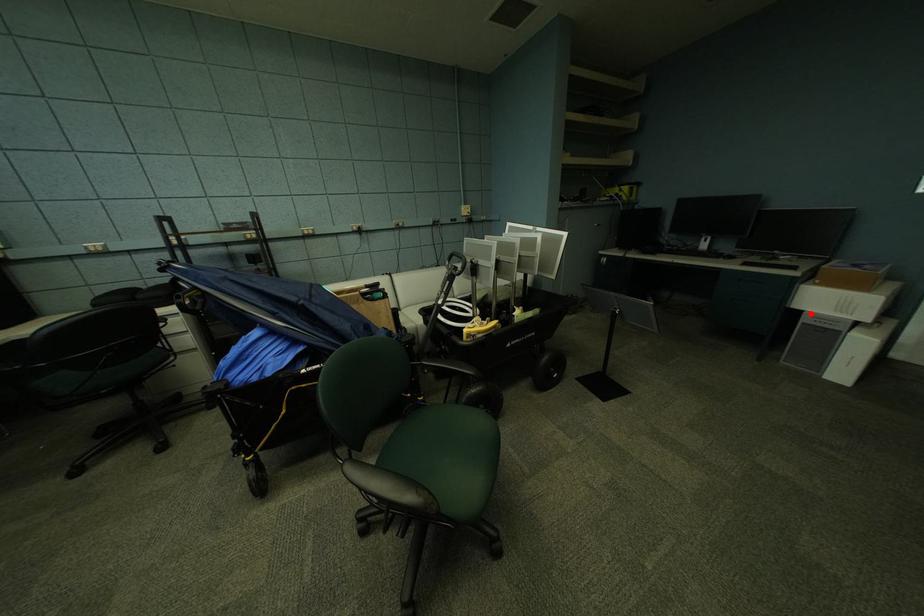
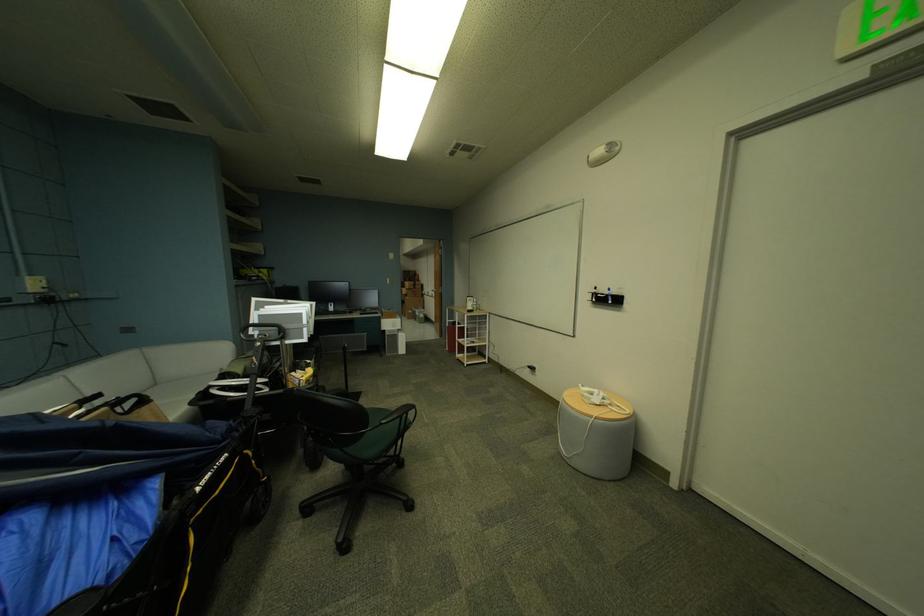
In the second image, find the point that corresponds to the highlighted location in the first image.

(393, 331)